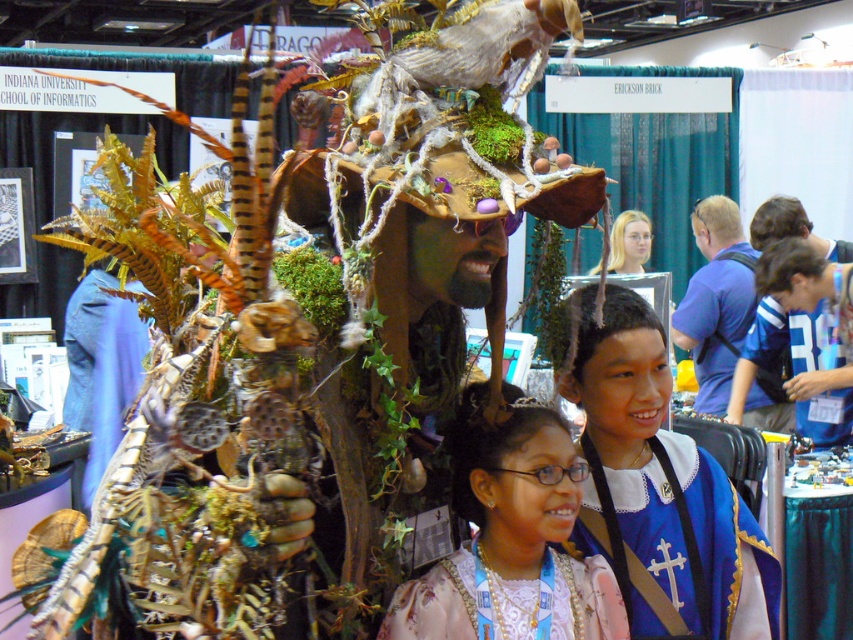
You are a photographer at the convention and want to position a camera at point A to capture the pink satin dress at center. Where should you place the camera to ensure the dress is in the frame?

The pink satin dress at center is located at point [511,538]. To capture it in the frame, position the camera at point A such that the dress falls within the camera view at that coordinate.